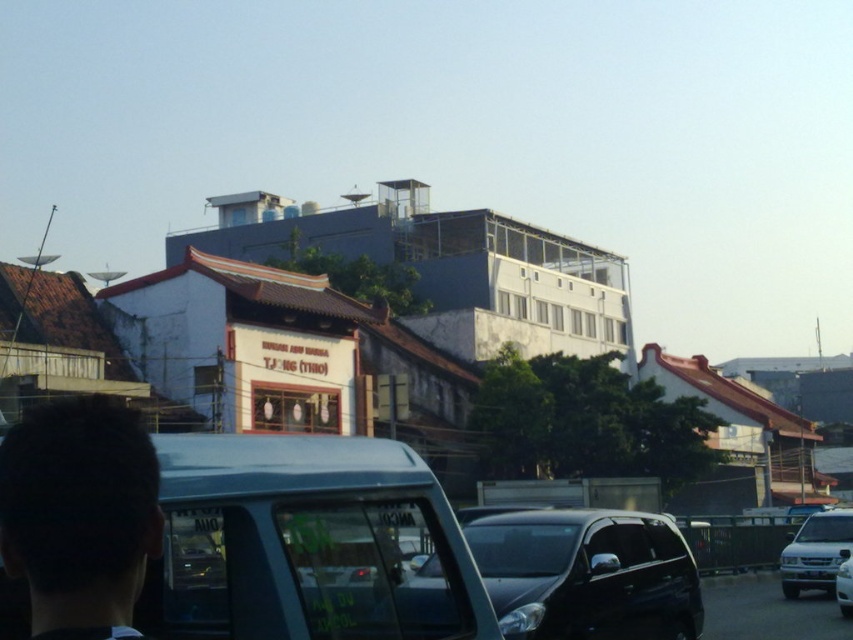
Can you confirm if black glossy car at center is smaller than white matte car at right?

Yes.

Is black glossy car at center thinner than white matte car at right?

Correct, black glossy car at center's width is less than white matte car at right's.

At what (x,y) coordinates should I click in order to perform the action: click on black glossy car at center. Please return your answer as a coordinate pair (x, y). The width and height of the screenshot is (853, 640). Looking at the image, I should click on (587, 573).

In the scene shown: Can you confirm if white matte car at right is positioned above white glossy car at center?

Actually, white matte car at right is below white glossy car at center.

Is point (805, 540) positioned after point (842, 579)?

Yes, point (805, 540) is behind point (842, 579).

Is point (799, 545) more distant than point (848, 557)?

Yes, it is.

I want to click on white matte car at right, so click(x=815, y=552).

Is dark hair at lower left below white matte car at right?

No, dark hair at lower left is not below white matte car at right.

Between point (91, 625) and point (787, 545), which one is positioned in front?

Positioned in front is point (91, 625).

Which is in front, point (41, 564) or point (839, 538)?

Point (41, 564) is more forward.

Identify the location of dark hair at lower left. This screenshot has height=640, width=853. (80, 515).